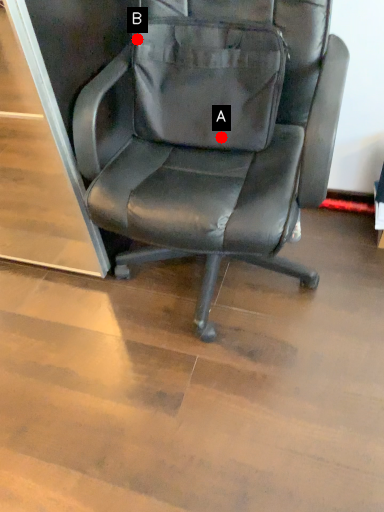
Question: Two points are circled on the image, labeled by A and B beside each circle. Which point appears closest to the camera in this image?

Choices:
 (A) A is closer
 (B) B is closer

Answer: (B)